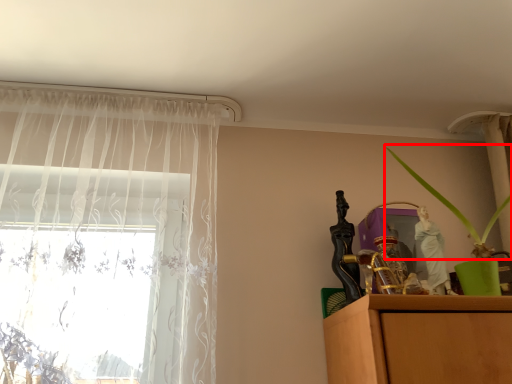
Question: Where is plant (annotated by the red box) located in relation to curtain in the image?

Choices:
 (A) left
 (B) right

Answer: (B)